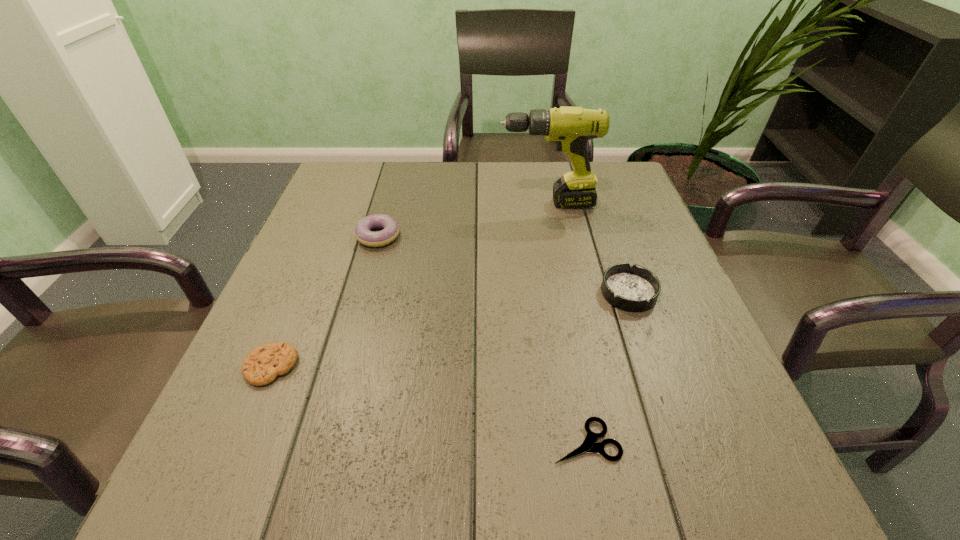
Choose which object is the nearest neighbor to the tallest object. Please provide its 2D coordinates. Your answer should be formatted as a tuple, i.e. [(x, y)], where the tuple contains the x and y coordinates of a point satisfying the conditions above.

[(635, 288)]

Where is `vacant position in the image that satisfies the following two spatial constraints: 1. on the back side of the second farthest object; 2. on the left side of the second shortest object`? vacant position in the image that satisfies the following two spatial constraints: 1. on the back side of the second farthest object; 2. on the left side of the second shortest object is located at coordinates tap(325, 236).

In order to click on free spot that satisfies the following two spatial constraints: 1. on the handle side of the drill; 2. on the right side of the third tallest object in this screenshot , I will do `click(563, 293)`.

The width and height of the screenshot is (960, 540). What are the coordinates of `free region that satisfies the following two spatial constraints: 1. on the back side of the leftmost object; 2. on the right side of the doughnut` in the screenshot? It's located at (325, 236).